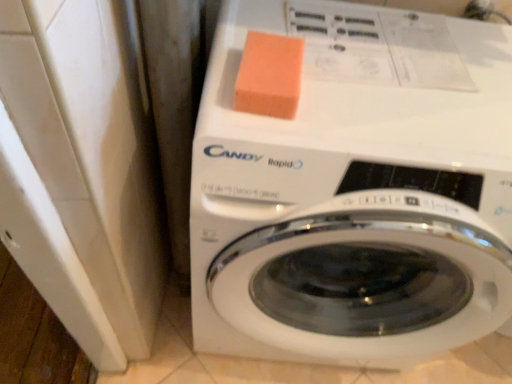
This screenshot has width=512, height=384. I want to click on orange sponge at upper center, so click(x=269, y=75).

What do you see at coordinates (269, 75) in the screenshot? I see `orange sponge at upper center` at bounding box center [269, 75].

The height and width of the screenshot is (384, 512). What are the coordinates of `white glossy washing machine at center` in the screenshot? It's located at (355, 189).

Measure the distance between point (281,321) and camera.

Point (281,321) is 35.71 inches away from camera.

This screenshot has height=384, width=512. What do you see at coordinates (355, 189) in the screenshot? I see `white glossy washing machine at center` at bounding box center [355, 189].

The image size is (512, 384). What are the coordinates of `orange sponge at upper center` in the screenshot? It's located at (269, 75).

Is orange sponge at upper center at the left side of white glossy washing machine at center?

Indeed, orange sponge at upper center is positioned on the left side of white glossy washing machine at center.

Considering the relative positions of orange sponge at upper center and white glossy washing machine at center in the image provided, is orange sponge at upper center behind white glossy washing machine at center?

That is True.

Which is less distant, (x=259, y=59) or (x=436, y=145)?

Clearly, point (x=259, y=59) is more distant from the camera than point (x=436, y=145).

From the image's perspective, would you say orange sponge at upper center is shown under white glossy washing machine at center?

Incorrect, from the image's perspective, orange sponge at upper center is higher than white glossy washing machine at center.

From a real-world perspective, is orange sponge at upper center above or below white glossy washing machine at center?

From a real-world perspective, orange sponge at upper center is physically above white glossy washing machine at center.

Looking at their sizes, would you say orange sponge at upper center is wider or thinner than white glossy washing machine at center?

In the image, orange sponge at upper center appears to be more narrow than white glossy washing machine at center.

Can you confirm if orange sponge at upper center is taller than white glossy washing machine at center?

Incorrect, the height of orange sponge at upper center is not larger of that of white glossy washing machine at center.

Who is smaller, orange sponge at upper center or white glossy washing machine at center?

Smaller between the two is orange sponge at upper center.

Which is correct: orange sponge at upper center is inside white glossy washing machine at center, or outside of it?

orange sponge at upper center exists entirely within white glossy washing machine at center.

Is orange sponge at upper center next to white glossy washing machine at center?

No, orange sponge at upper center is not in contact with white glossy washing machine at center.

Is white glossy washing machine at center at the back of orange sponge at upper center?

No, orange sponge at upper center is not facing away from white glossy washing machine at center.

At what (x,y) coordinates should I click in order to perform the action: click on washing machine on the right side of orange sponge at upper center. Please return your answer as a coordinate pair (x, y). The width and height of the screenshot is (512, 384). Looking at the image, I should click on point(355,189).

Would you say white glossy washing machine at center is to the left or to the right of orange sponge at upper center in the picture?

From the image, it's evident that white glossy washing machine at center is to the right of orange sponge at upper center.

Consider the image. Which is behind, white glossy washing machine at center or orange sponge at upper center?

Positioned behind is orange sponge at upper center.

Is point (463, 115) behind point (243, 87)?

Yes, it is.

From the image's perspective, is white glossy washing machine at center located above orange sponge at upper center?

No, from the image's perspective, white glossy washing machine at center is not above orange sponge at upper center.

From a real-world perspective, is white glossy washing machine at center above or below orange sponge at upper center?

In terms of real-world spatial position, white glossy washing machine at center is below orange sponge at upper center.

Considering the sizes of objects white glossy washing machine at center and orange sponge at upper center in the image provided, who is wider, white glossy washing machine at center or orange sponge at upper center?

With larger width is white glossy washing machine at center.

Can you confirm if white glossy washing machine at center is taller than orange sponge at upper center?

Yes.

Can you confirm if white glossy washing machine at center is smaller than orange sponge at upper center?

No.

Looking at this image, do you think white glossy washing machine at center is within orange sponge at upper center, or outside of it?

white glossy washing machine at center lies outside orange sponge at upper center.

Is white glossy washing machine at center far away from orange sponge at upper center?

No.

Is white glossy washing machine at center positioned with its back to orange sponge at upper center?

No, white glossy washing machine at center's orientation is not away from orange sponge at upper center.

Locate an element on the screen. Image resolution: width=512 pixels, height=384 pixels. soap on the left of white glossy washing machine at center is located at coordinates (269, 75).

I want to click on washing machine below the orange sponge at upper center (from the image's perspective), so [355, 189].

Where is `washing machine in front of the orange sponge at upper center`? The width and height of the screenshot is (512, 384). washing machine in front of the orange sponge at upper center is located at coordinates (355, 189).